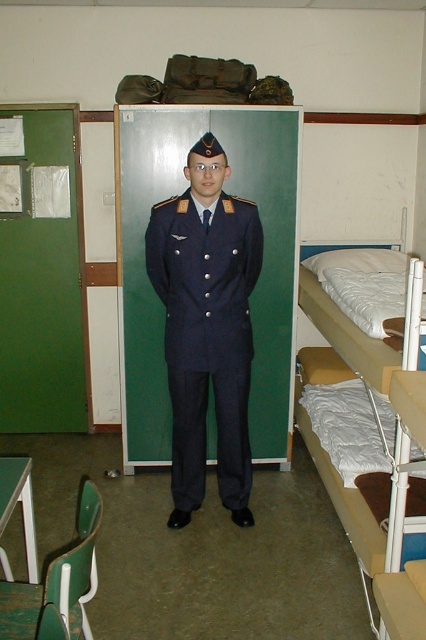
You are a military recruit who needs to store your navy blue uniform at center. The white fabric bunk bed at right has limited space underneath. Can you place your uniform under the bed without folding it?

The navy blue uniform at center is above the white fabric bunk bed at right, which means the uniform is currently located above the bed. To store it underneath, you would need to move it from its current position above the bed to the space beneath. However, the description does not provide information about the size or accessibility of the space under the bed, so it is unclear if the uniform can fit there without folding. Additional details about the bed structure or available space are needed to determine.

You are a photographer planning to take a portrait of the person in the navy blue uniform at center. The white fabric bunk bed at right is in the background. To ensure the uniform is the main focus, should you adjust your camera to focus on a closer or farther distance compared to the bunk bed?

The navy blue uniform at center has a greater height compared to the white fabric bunk bed at right, so to focus on the uniform, you should adjust the camera to focus on a closer distance than the bunk bed.